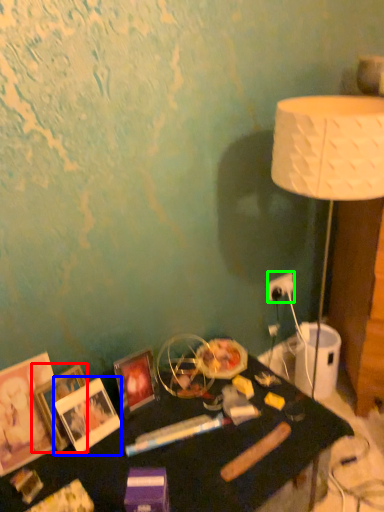
Question: Considering the real-world distances, which object is farthest from picture frame (highlighted by a red box)? picture frame (highlighted by a blue box) or electric outlet (highlighted by a green box)?

Choices:
 (A) picture frame
 (B) electric outlet

Answer: (B)